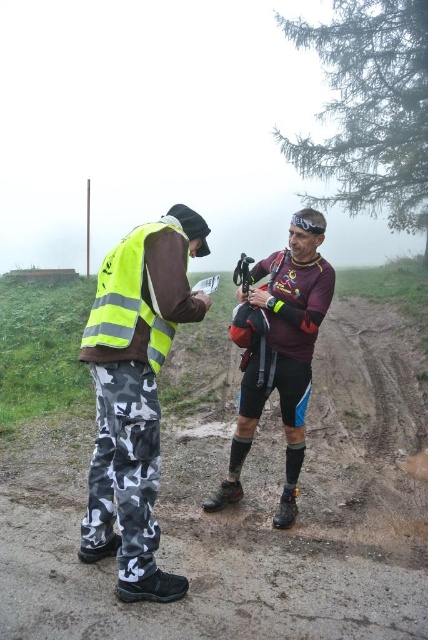
Question: Observing the image, what is the correct spatial positioning of maroon synthetic shirt at center in reference to camouflage pants at lower left?

Choices:
 (A) left
 (B) right

Answer: (B)

Question: Which point appears closest to the camera in this image?

Choices:
 (A) (142, 563)
 (B) (297, 618)

Answer: (B)

Question: Is high visibility fabric vest at left positioned at the back of camouflage pants at lower left?

Choices:
 (A) no
 (B) yes

Answer: (A)

Question: Does high visibility fabric vest at left have a larger size compared to camouflage pants at lower left?

Choices:
 (A) yes
 (B) no

Answer: (A)

Question: Which of the following is the farthest from the observer?

Choices:
 (A) (151, 340)
 (B) (92, 504)
 (C) (427, 612)
 (D) (262, 307)

Answer: (D)

Question: Estimate the real-world distances between objects in this image. Which object is closer to the camouflage pants at lower left?

Choices:
 (A) high visibility fabric vest at left
 (B) yellow reflective safety vest at left
 (C) brown dirt track at center
 (D) maroon synthetic shirt at center

Answer: (A)